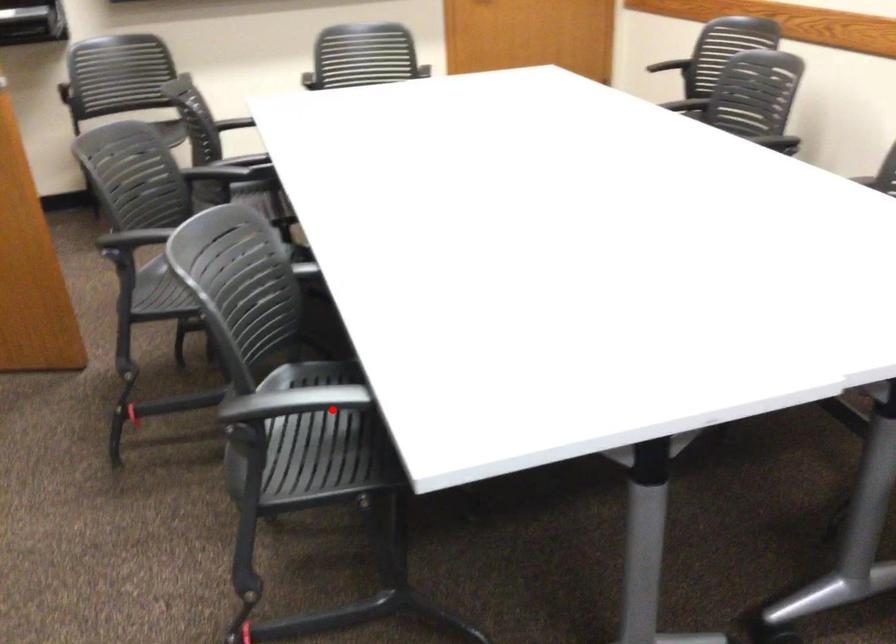
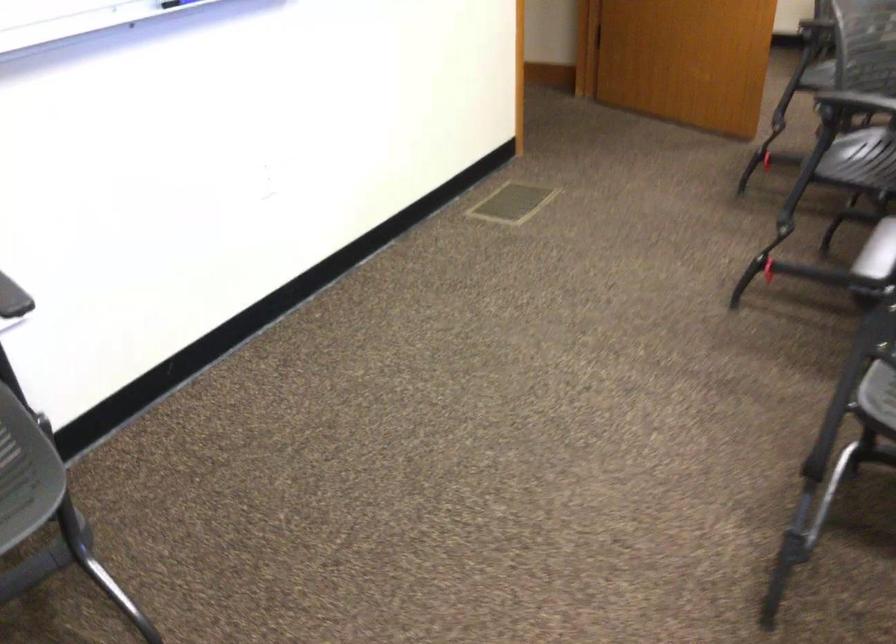
Question: I am providing you with two images of the same scene from different viewpoints. A red point is shown in image1. For the corresponding object point in image2, is it positioned nearer or farther from the camera?

Choices:
 (A) Nearer
 (B) Farther

Answer: (B)